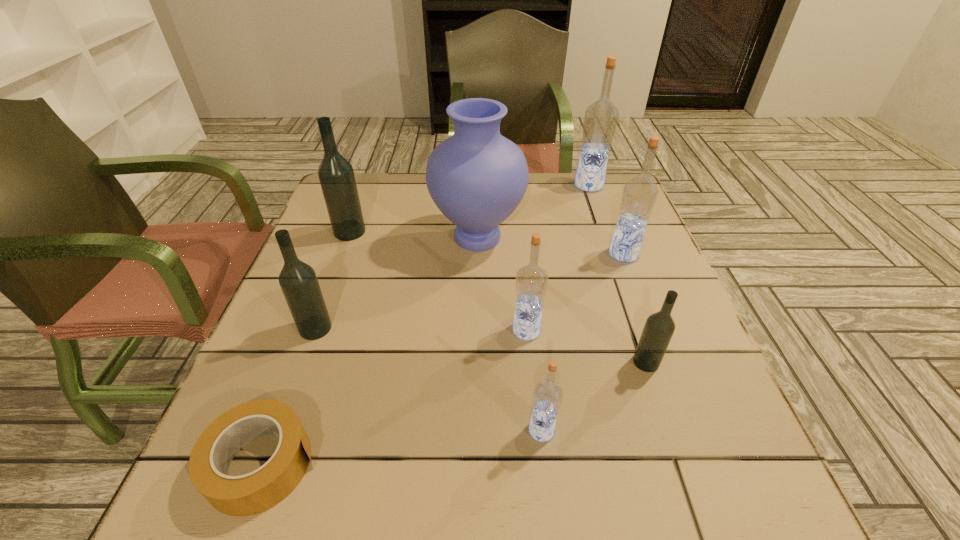
This screenshot has width=960, height=540. In order to click on the tallest vodka in this screenshot , I will do `click(600, 121)`.

I want to click on the farthest object, so click(600, 121).

What are the coordinates of `blue vase` in the screenshot? It's located at (477, 177).

Where is `the sixth nearest vodka`? This screenshot has width=960, height=540. the sixth nearest vodka is located at coordinates (336, 175).

Identify the location of the farthest black vodka. (336, 175).

Where is `the fifth nearest vodka`? This screenshot has height=540, width=960. the fifth nearest vodka is located at coordinates (639, 195).

Locate an element on the screen. This screenshot has height=540, width=960. the third nearest blue vodka is located at coordinates (639, 195).

Identify the location of the second biggest black vodka. This screenshot has height=540, width=960. (298, 281).

Where is `the second nearest blue vodka`? the second nearest blue vodka is located at coordinates (531, 281).

Locate an element on the screen. Image resolution: width=960 pixels, height=540 pixels. the rightmost black vodka is located at coordinates (658, 330).